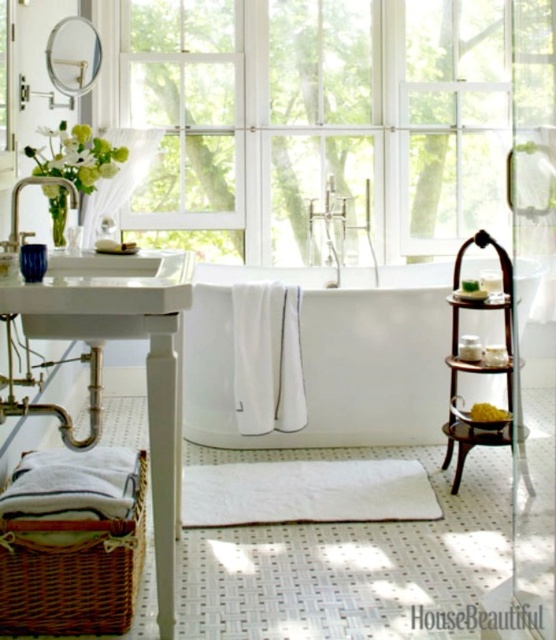
You are standing in the bathroom and want to place a small plant between the two points labeled point (450, 49) and point (82, 312). Which point should the plant be closer to in order to be closer to the pedestal sink?

The plant should be closer to point (450, 49) because it is closer to the pedestal sink than point (82, 312).

You are standing in the bathroom and want to look out the white glass window at upper center. To do so, which direction should you turn from facing the white wood vanity at left?

Since the white glass window at upper center is to the right of the white wood vanity at left, you should turn to your right to face the white glass window at upper center.

You are standing in the bathroom and want to reach the matte silver faucet at left to turn on the water. Can you directly access it without moving around the white glossy bathtub at center?

The matte silver faucet at left is behind the white glossy bathtub at center, so you cannot directly access it without moving around the white glossy bathtub at center.